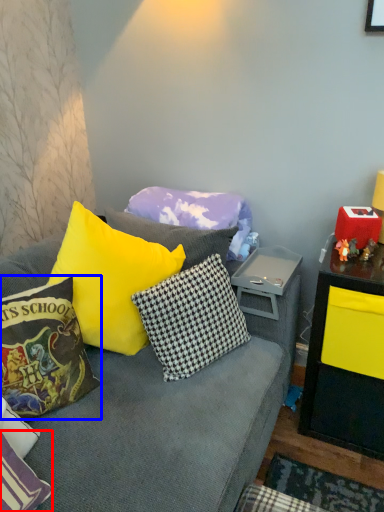
Question: Which object appears farthest to the camera in this image, pillow (highlighted by a red box) or pillow (highlighted by a blue box)?

Choices:
 (A) pillow
 (B) pillow

Answer: (B)